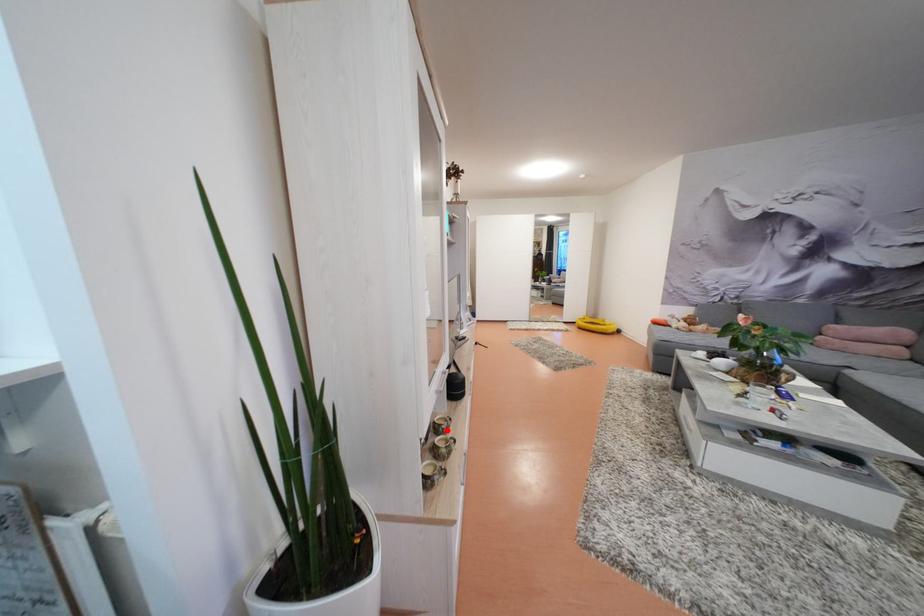
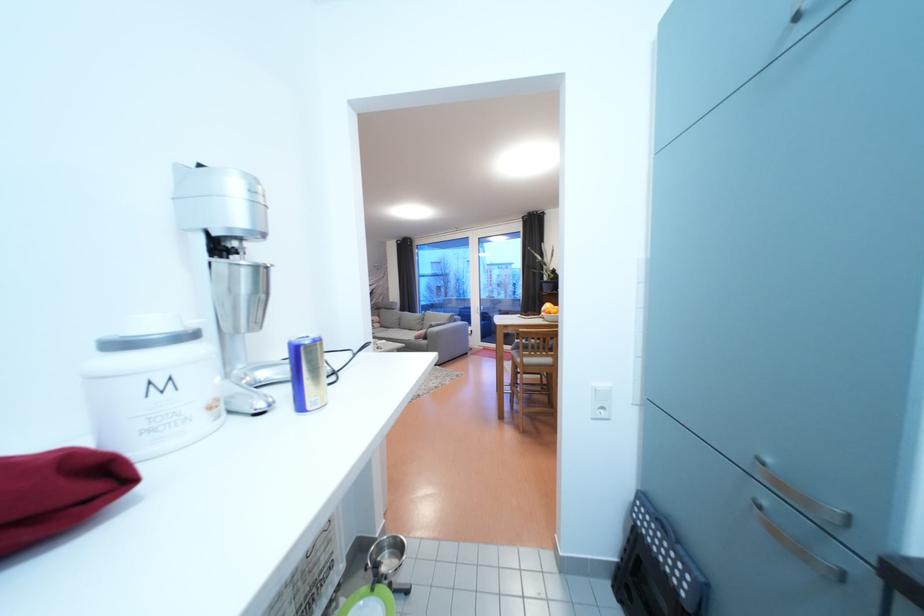
Question: I am providing you with two images of the same scene from different viewpoints. A red point is marked on the first image. Is the red point's position out of view in image 2?

Choices:
 (A) Yes
 (B) No

Answer: (A)